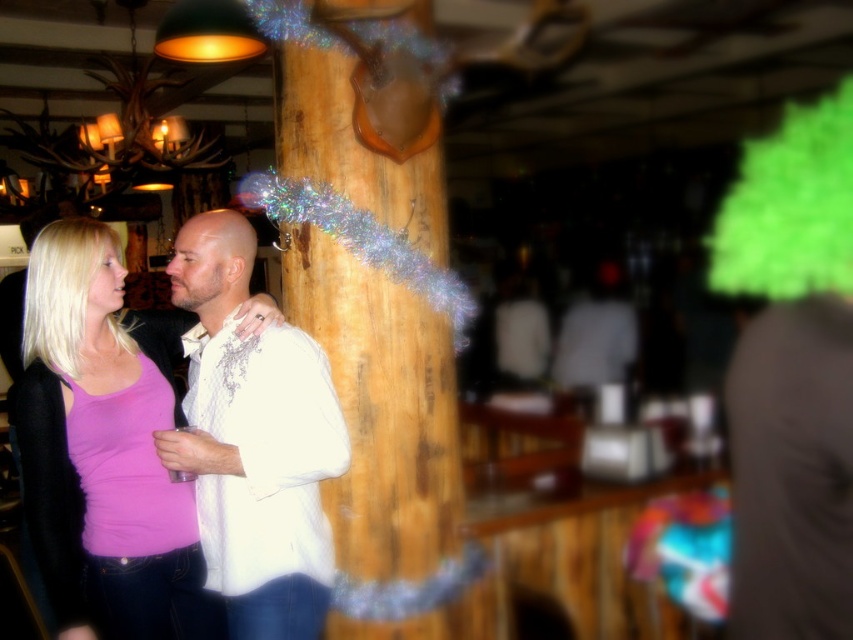
Is white satin shirt at center below green fuzzy wig at upper right?

Correct, white satin shirt at center is located below green fuzzy wig at upper right.

Can you confirm if white satin shirt at center is positioned to the left of green fuzzy wig at upper right?

Indeed, white satin shirt at center is positioned on the left side of green fuzzy wig at upper right.

The width and height of the screenshot is (853, 640). I want to click on white satin shirt at center, so click(254, 444).

The image size is (853, 640). I want to click on white satin shirt at center, so click(254, 444).

Which of these two, pink fabric tank top at center or green fuzzy wig at upper right, stands shorter?

With less height is pink fabric tank top at center.

Does point (132, 538) come closer to viewer compared to point (769, 189)?

Yes, point (132, 538) is in front of point (769, 189).

Which is in front, point (244, 323) or point (805, 268)?

Point (244, 323) is more forward.

This screenshot has width=853, height=640. What are the coordinates of `pink fabric tank top at center` in the screenshot? It's located at [102, 448].

Does pink fabric tank top at center appear under white satin shirt at center?

Indeed, pink fabric tank top at center is positioned under white satin shirt at center.

Is pink fabric tank top at center above white satin shirt at center?

Incorrect, pink fabric tank top at center is not positioned above white satin shirt at center.

Image resolution: width=853 pixels, height=640 pixels. In order to click on pink fabric tank top at center in this screenshot , I will do `click(102, 448)`.